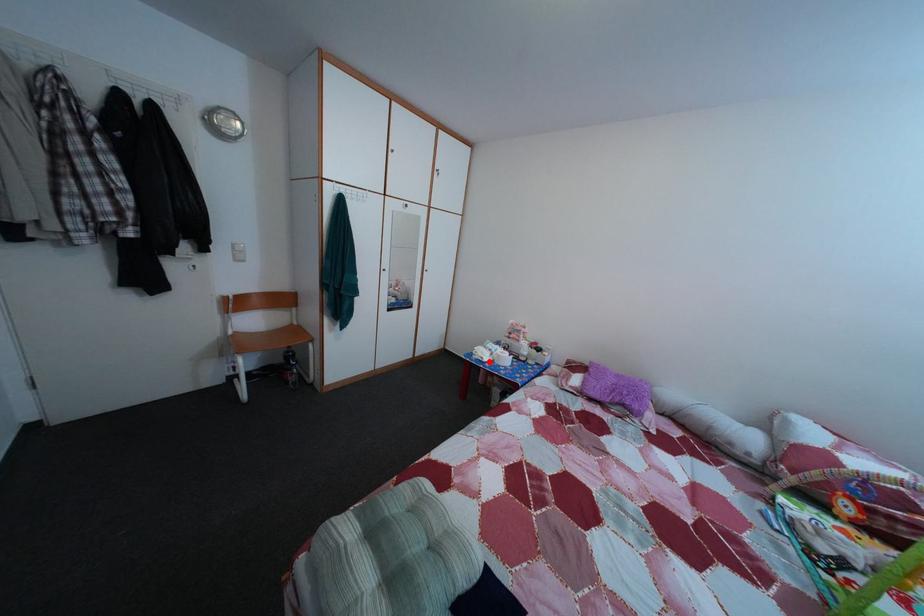
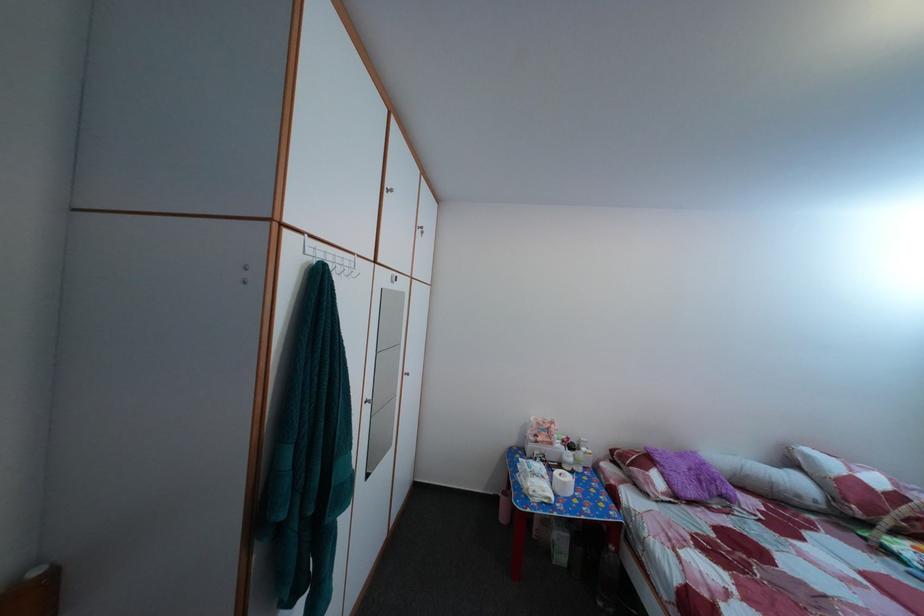
Locate, in the second image, the point that corresponds to the highlighted location in the first image.

(551, 500)